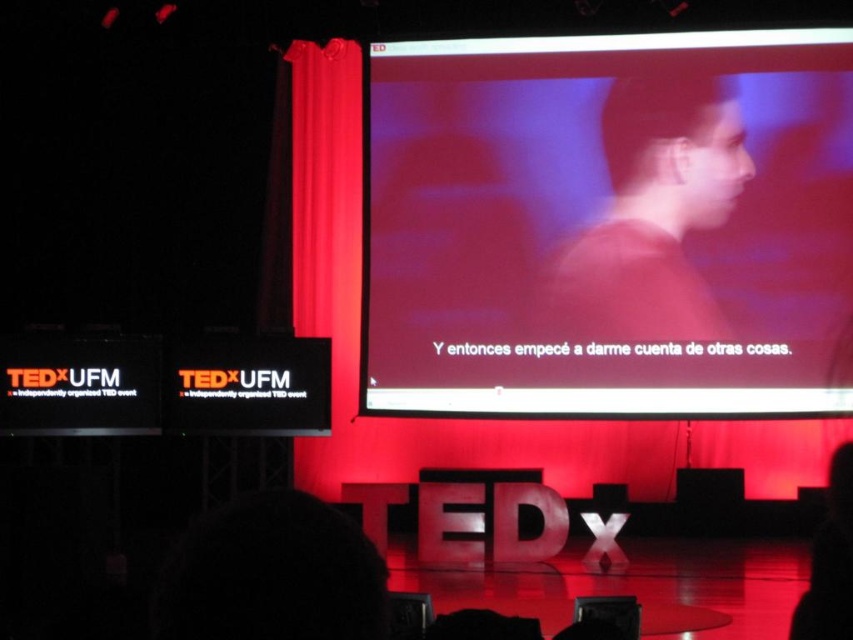
You are a stagehand at the TEDx event at UFM. You need to move a 10 feet long ladder from the backstage area to the front of the stage. The ladder must be placed between the matte screen at center and the TEDx logo on the stage floor. Is there enough space for the ladder to fit between them?

The distance between the matte screen at center and the TEDx logo on the stage floor is 58.58 feet, which is more than enough to accommodate a 10 feet long ladder. Therefore, the ladder can be placed between them without any issues.